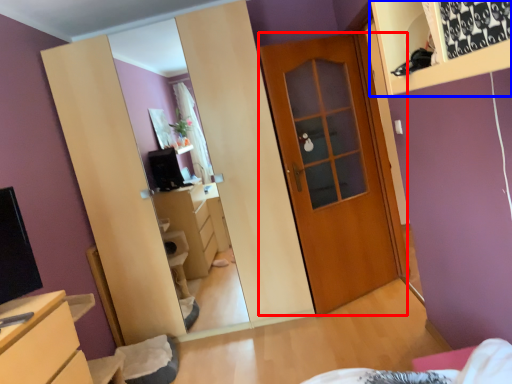
Question: Which point is further to the camera, door (highlighted by a red box) or shelf (highlighted by a blue box)?

Choices:
 (A) door
 (B) shelf

Answer: (A)